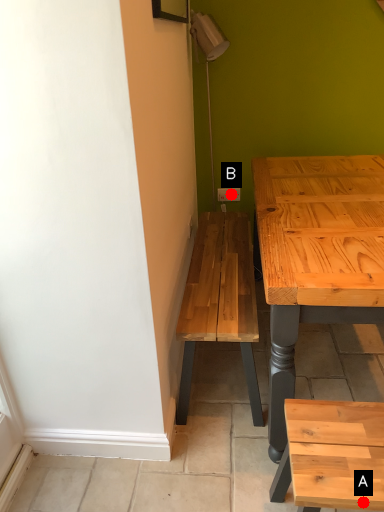
Question: Two points are circled on the image, labeled by A and B beside each circle. Which point appears farthest from the camera in this image?

Choices:
 (A) A is further
 (B) B is further

Answer: (B)